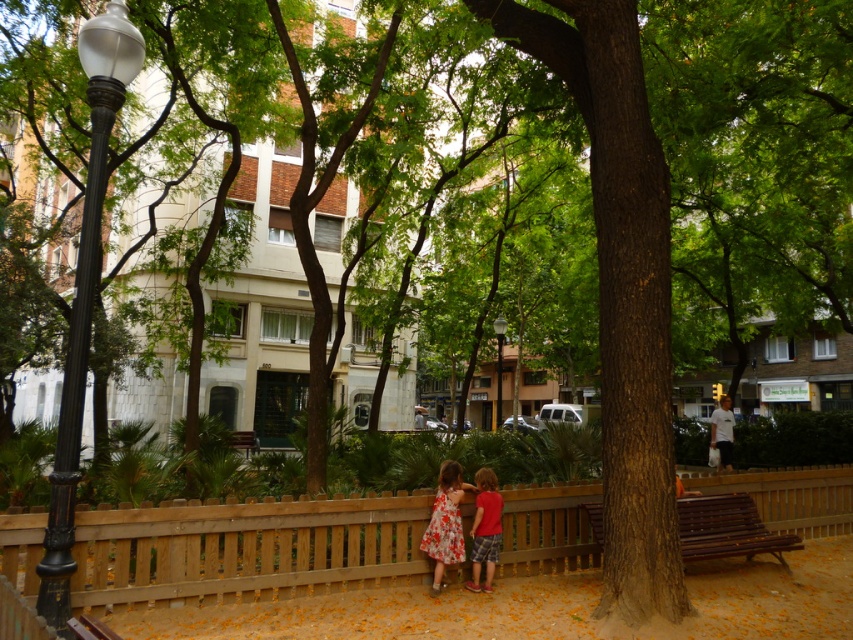
You are a park visitor trying to sit down. There is a brown wooden bench at center and a red cotton shirt at center. Which object is wider so you can choose the best seating option?

The brown wooden bench at center is wider than the red cotton shirt at center, so you should choose the bench for seating.

You are a city planner reviewing the park layout. The city requires all street lamps to be placed at least 0.5 meters away from the park fence. Given the coordinate system where the bottom left corner is the origin, can the black polished metal lamp post at left be compliant with this regulation?

The black polished metal lamp post at left is located at coordinate point (84, 294). Since the park fence is at the edge of the image, which corresponds to the origin point 0.0, the lamp post is 0.461 meters away from the fence along the x axis. This distance is less than the required 0.5 meters, so it does not comply with the regulation.

You are standing at the point with coordinates point (489,493) and want to walk to the point with coordinates point (753,554). Which direction should you move in to reach your destination?

To reach point (753,554) from point (489,493), you should move towards the northeast direction since point (753,554) is located northeast of point (489,493).